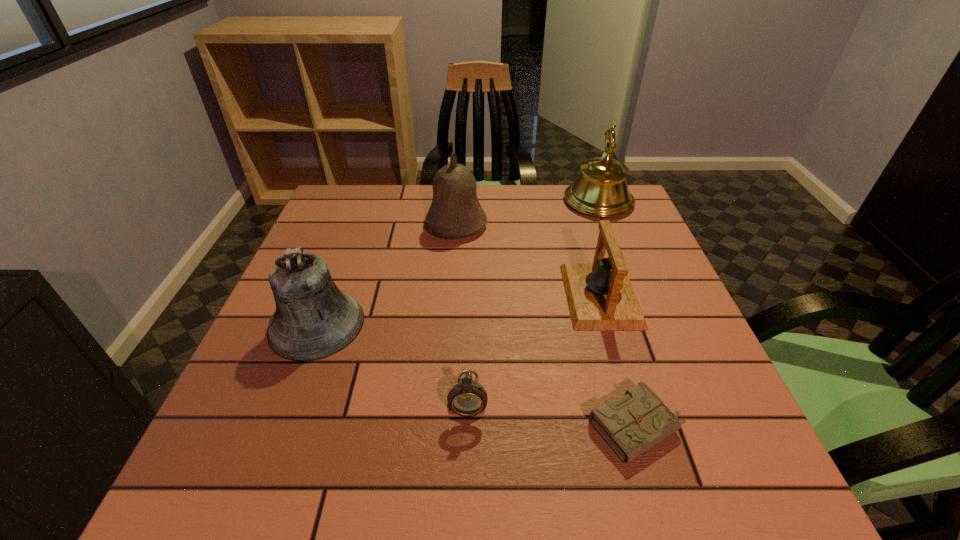
Find the location of a particular element. The height and width of the screenshot is (540, 960). free space between the leftmost bell and the third bell from right to left is located at coordinates (386, 274).

Where is `free spot between the shortest bell and the leftmost object`? This screenshot has height=540, width=960. free spot between the shortest bell and the leftmost object is located at coordinates (459, 310).

The image size is (960, 540). I want to click on empty space that is in between the diary and the fourth tallest object, so click(x=619, y=362).

This screenshot has height=540, width=960. What are the coordinates of `vacant region between the third bell from right to left and the leftmost bell` in the screenshot? It's located at (386, 274).

The image size is (960, 540). I want to click on free space between the leftmost object and the second bell from left to right, so click(x=386, y=274).

The height and width of the screenshot is (540, 960). Find the location of `unoccupied position between the fourth tallest object and the shortest object`. unoccupied position between the fourth tallest object and the shortest object is located at coordinates (619, 362).

Locate an element on the screen. The width and height of the screenshot is (960, 540). free space between the compass and the shortest object is located at coordinates (553, 411).

In order to click on object that stands as the fifth closest to the compass in this screenshot , I will do `click(601, 189)`.

Select which object appears as the fifth closest to the fifth tallest object. Please provide its 2D coordinates. Your answer should be formatted as a tuple, i.e. [(x, y)], where the tuple contains the x and y coordinates of a point satisfying the conditions above.

[(601, 189)]

Select which bell is the third closest to the leftmost bell. Please provide its 2D coordinates. Your answer should be formatted as a tuple, i.e. [(x, y)], where the tuple contains the x and y coordinates of a point satisfying the conditions above.

[(601, 189)]